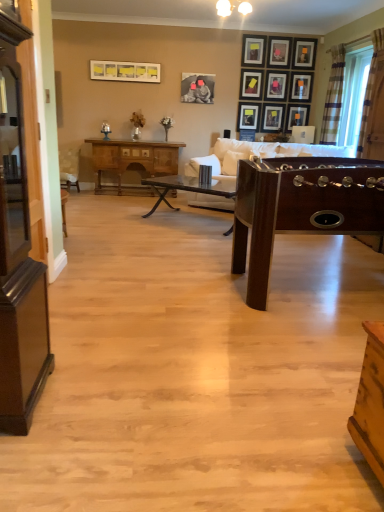
I want to click on free space above matte yellow picture frame at upper center, which appears as the eleventh picture frame when viewed from the right (from a real-world perspective), so click(x=123, y=62).